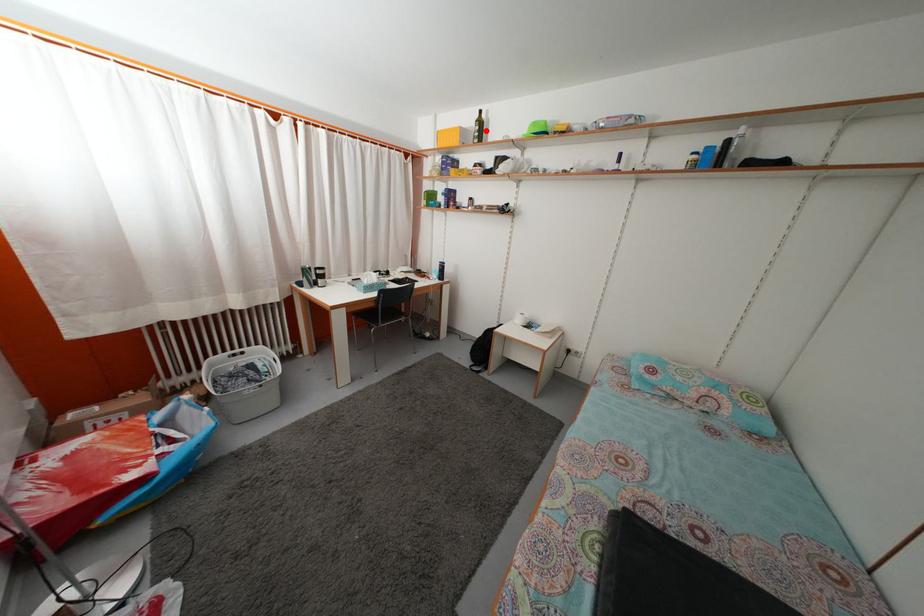
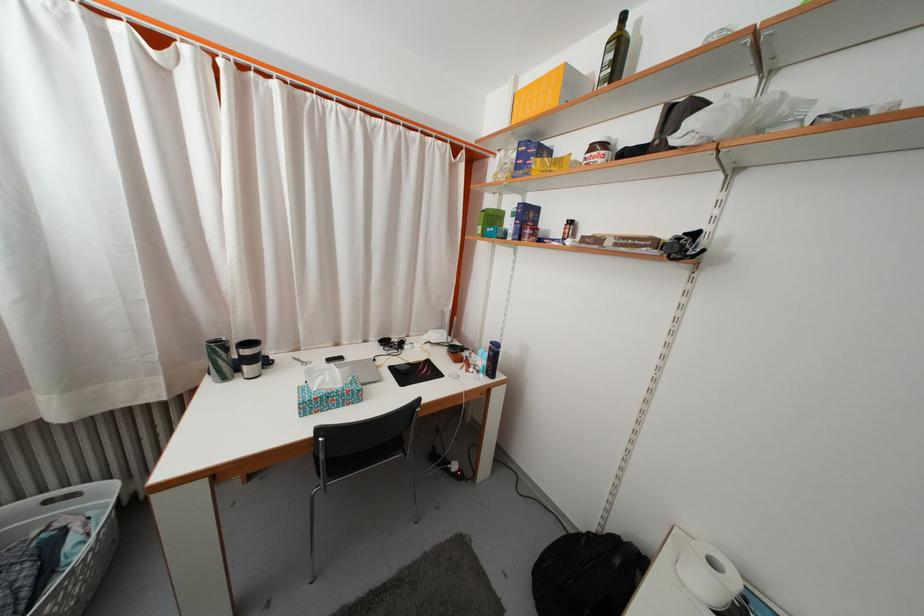
The point at the highlighted location is marked in the first image. Where is the corresponding point in the second image?

(625, 54)